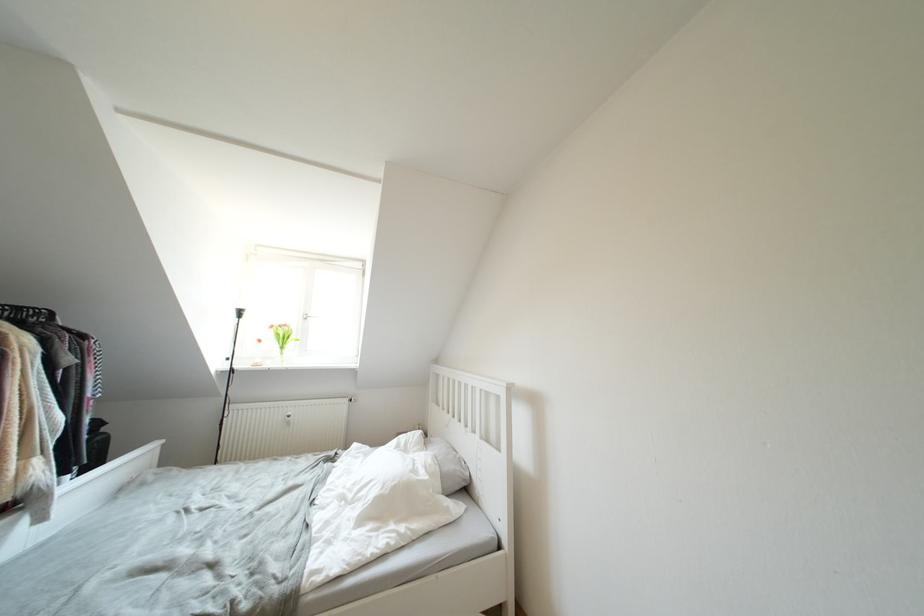
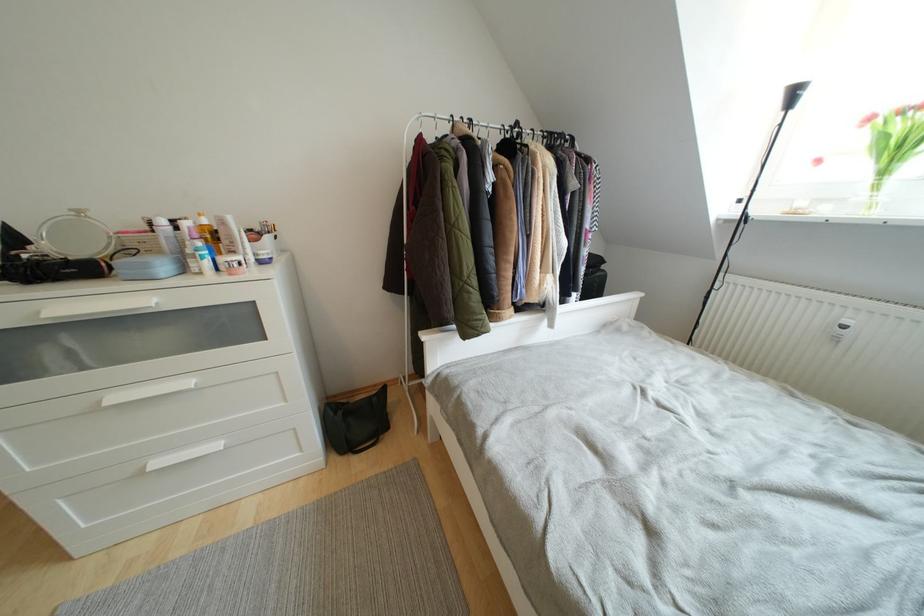
Based on the continuous images, in which direction is the camera rotating?

The rotation direction of the camera is left-down.